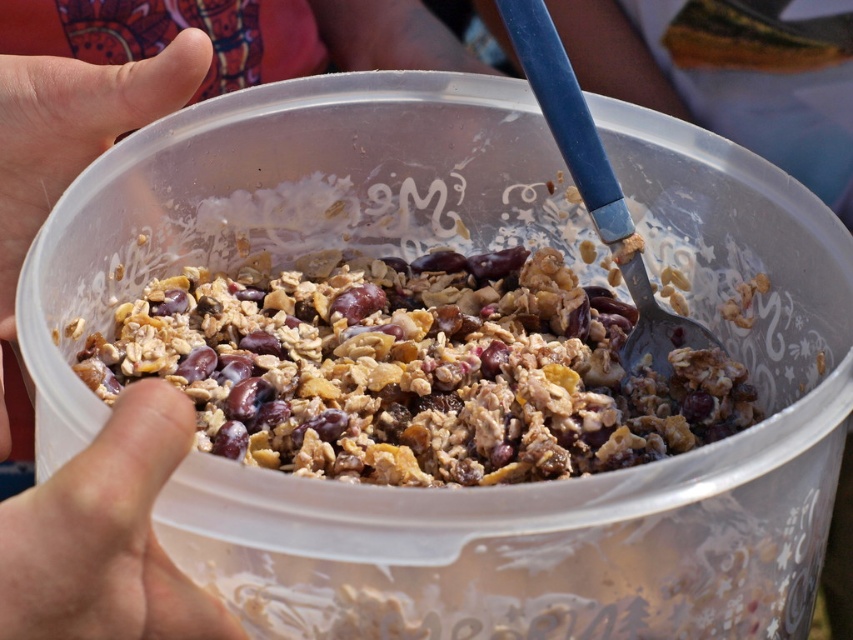
You are holding the container and want to place a new spoon at point (161,284) and point (42,504). Which point is closer to you?

Point (42,504) is closer to you because it is in front of point (161,284).

You are holding a clear plastic container with a mixture of granola and a blue spoon inside. There is a point at coordinates point [148,404]. If you want to place a sticker exactly at that point on the container, how far in centimeters should you place it from your eyes?

The point [148,404] is 26.56 centimeters away from the viewer, so you should place the sticker 26.56 centimeters from your eyes.